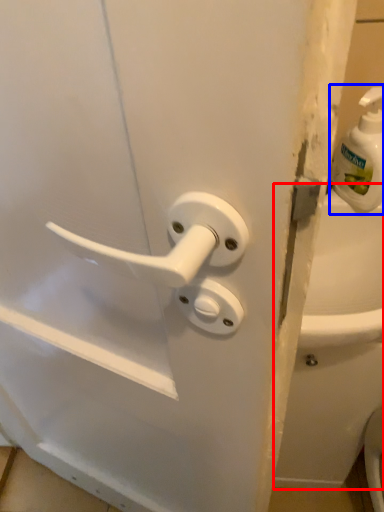
Question: Among these objects, which one is nearest to the camera, bath (highlighted by a red box) or soap dispenser (highlighted by a blue box)?

Choices:
 (A) bath
 (B) soap dispenser

Answer: (B)